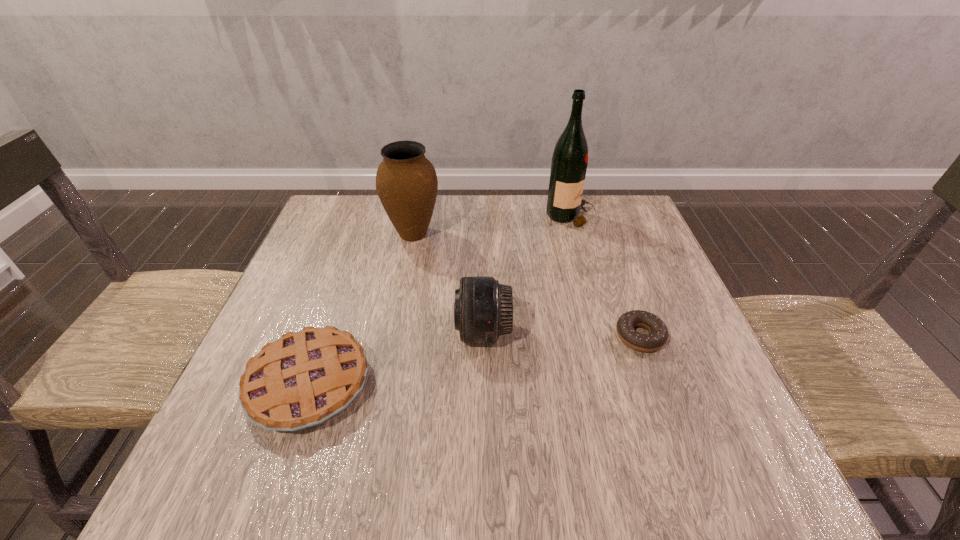
Locate an element on the screen. wine bottle is located at coordinates (569, 163).

This screenshot has height=540, width=960. In order to click on the second tallest object in this screenshot , I will do `click(406, 181)`.

The width and height of the screenshot is (960, 540). What are the coordinates of `telephoto lens` in the screenshot? It's located at (x=483, y=310).

At what (x,y) coordinates should I click in order to perform the action: click on the third shortest object. Please return your answer as a coordinate pair (x, y). The width and height of the screenshot is (960, 540). Looking at the image, I should click on (483, 310).

I want to click on the second shortest object, so click(x=305, y=378).

The image size is (960, 540). What are the coordinates of `the shortest object` in the screenshot? It's located at (658, 336).

At what (x,y) coordinates should I click in order to perform the action: click on free space located on the left of the wine bottle. Please return your answer as a coordinate pair (x, y). The image size is (960, 540). Looking at the image, I should click on (429, 217).

At what (x,y) coordinates should I click in order to perform the action: click on vacant space located on the front of the second tallest object. Please return your answer as a coordinate pair (x, y). Looking at the image, I should click on (403, 283).

This screenshot has height=540, width=960. I want to click on vacant point located 0.360m on the front-facing side of the third object from left to right, so click(x=283, y=332).

The width and height of the screenshot is (960, 540). Identify the location of free space located 0.300m on the front-facing side of the third object from left to right. (312, 332).